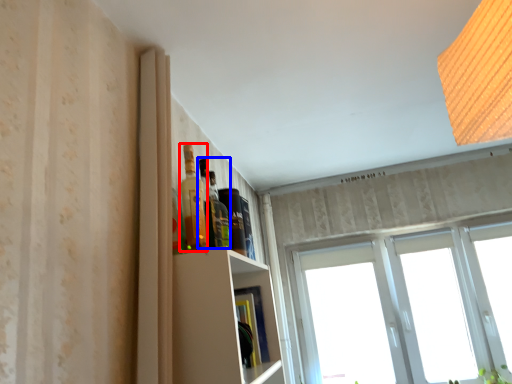
Question: Among these objects, which one is nearest to the camera, bottle (highlighted by a red box) or bottle (highlighted by a blue box)?

Choices:
 (A) bottle
 (B) bottle

Answer: (A)